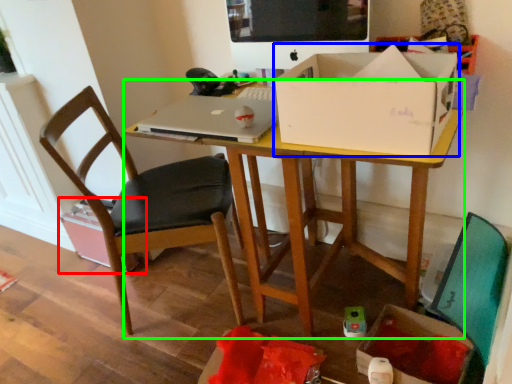
Question: Which object is the closest to the cardboard box (highlighted by a red box)? Choose among these: box (highlighted by a blue box) or desk (highlighted by a green box).

Choices:
 (A) box
 (B) desk

Answer: (B)